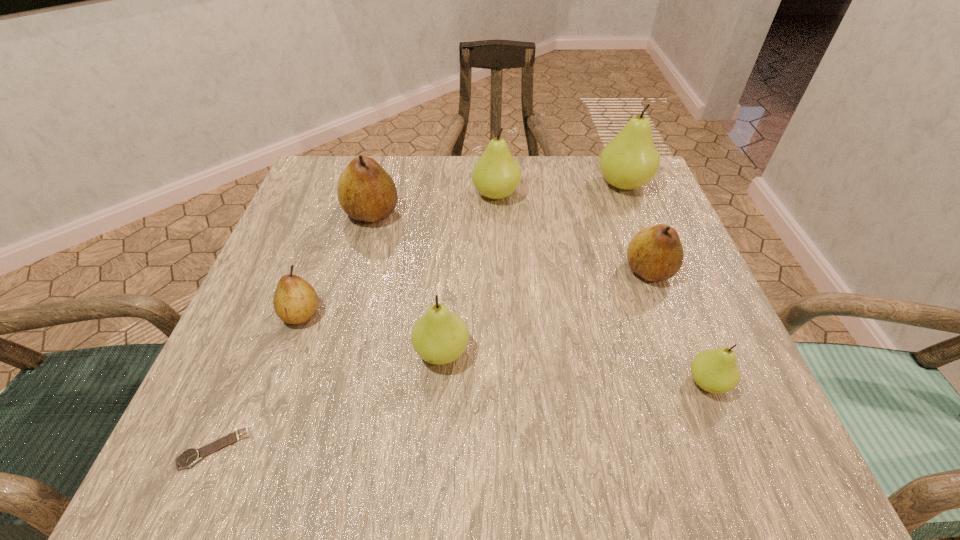
Where is `watch positioned at the left edge`? watch positioned at the left edge is located at coordinates (189, 457).

This screenshot has width=960, height=540. Find the location of `object located in the far left corner section of the desktop`. object located in the far left corner section of the desktop is located at coordinates (366, 192).

Where is `object at the near left corner`? This screenshot has height=540, width=960. object at the near left corner is located at coordinates (189, 457).

Where is `object that is at the far right corner`? This screenshot has width=960, height=540. object that is at the far right corner is located at coordinates (630, 160).

This screenshot has width=960, height=540. In order to click on vacant space at the far edge in this screenshot , I will do `click(411, 200)`.

In the image, there is a desktop. Identify the location of vacant space at the near edge. (572, 442).

Identify the location of vacant space at the left edge. The height and width of the screenshot is (540, 960). (341, 300).

The width and height of the screenshot is (960, 540). In order to click on vacant area at the right edge in this screenshot , I will do `click(633, 336)`.

In the image, there is a desktop. Identify the location of vacant space at the far left corner. (318, 198).

Locate an element on the screen. free space that is in between the tallest pear and the farthest brown pear is located at coordinates (497, 199).